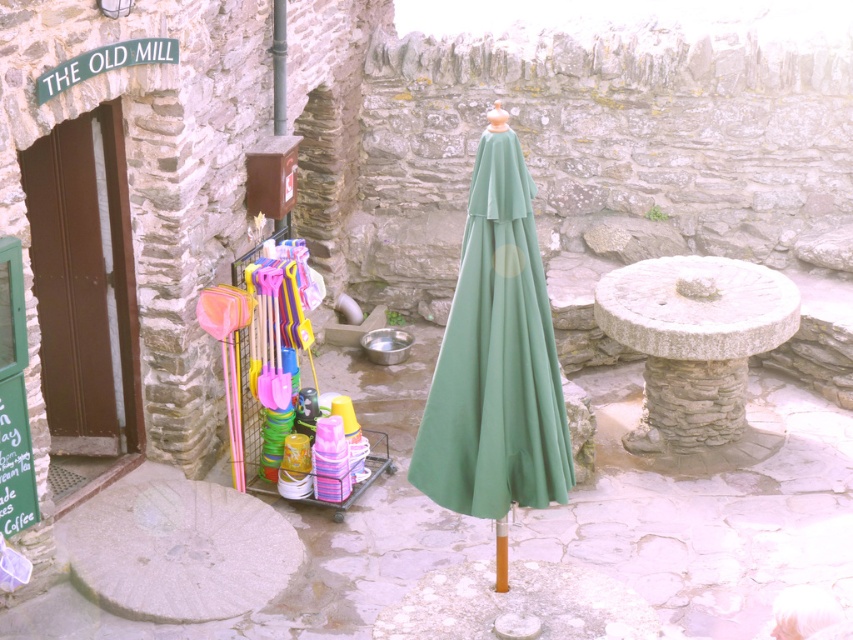
You are standing at the entrance of The Old Mill and want to walk towards the point at coordinates point (711, 435) and point (496, 563). Which point will you reach first?

You will reach point (496, 563) first because point (711, 435) is behind it.

You are standing at the entrance of The Old Mill and want to walk to the point that is closer to you. Which point should you head towards, point [467,444] or point [279,24]?

You should head towards point [467,444] because it is closer to the viewer than point [279,24].